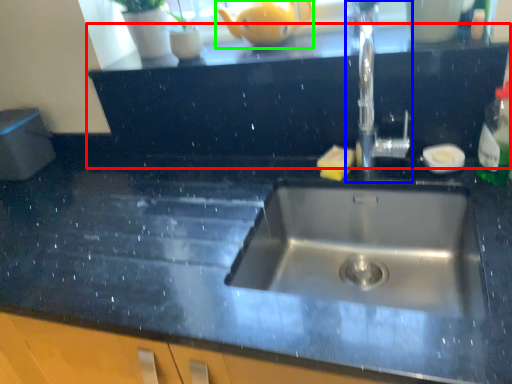
Question: Considering the real-world distances, which object is closest to dresser (highlighted by a red box)? tap (highlighted by a blue box) or tea pot (highlighted by a green box).

Choices:
 (A) tap
 (B) tea pot

Answer: (A)